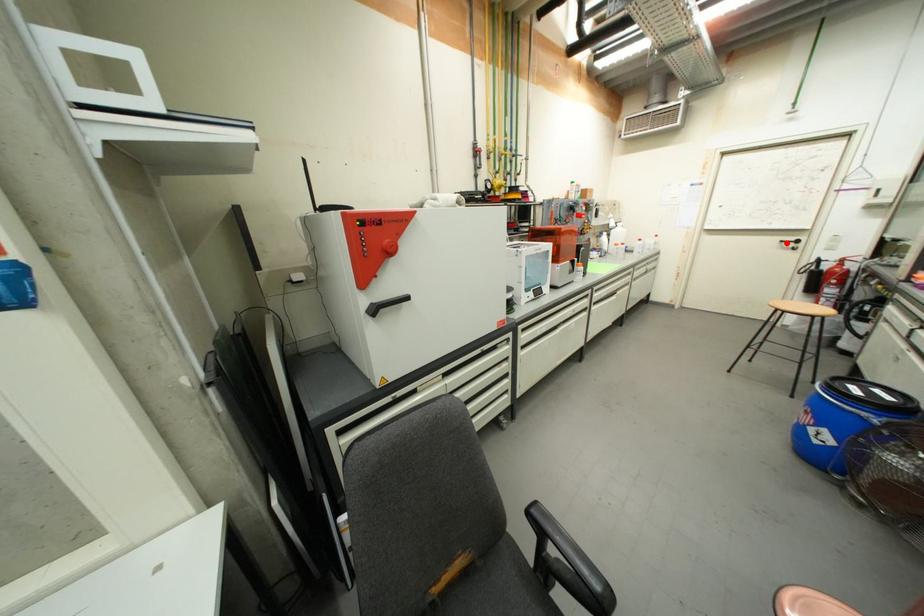
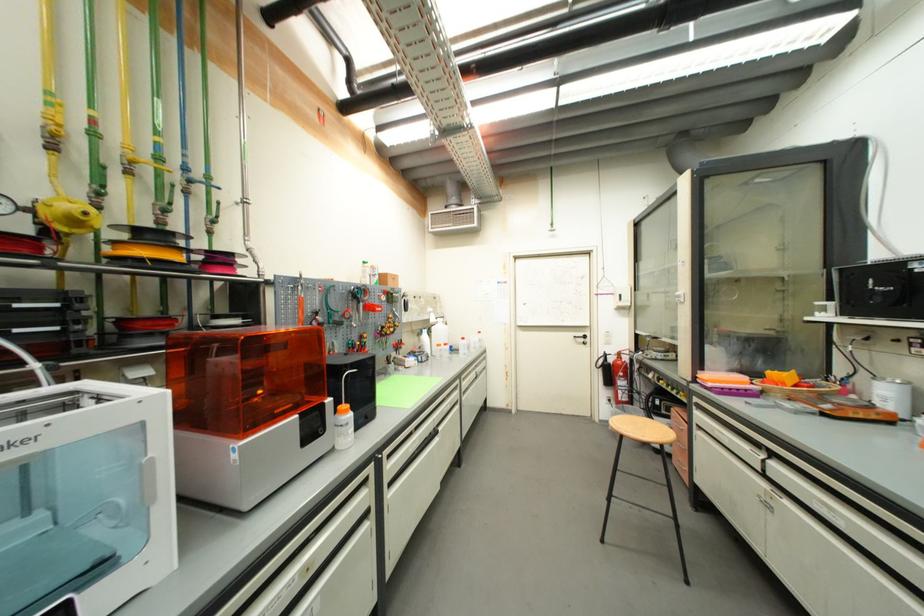
Where in the second image is the point corresponding to the highlighted location from the first image?

(580, 339)